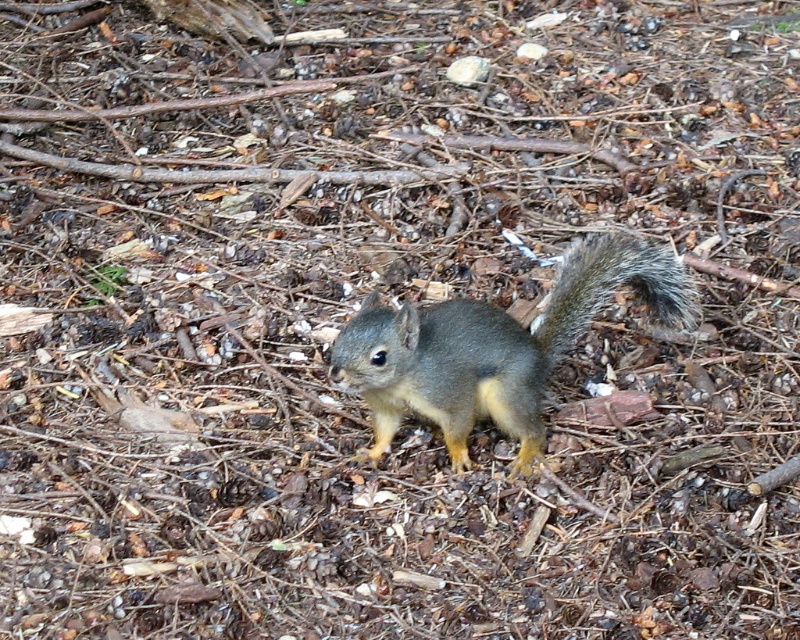
What are the coordinates of `shiny gray squirrel at center` in the screenshot? It's located at (496, 346).

How far apart are shiny gray squirrel at center and fuzzy brown tail at center?

shiny gray squirrel at center is 9.12 centimeters from fuzzy brown tail at center.

The image size is (800, 640). Describe the element at coordinates (496, 346) in the screenshot. I see `shiny gray squirrel at center` at that location.

You are a GUI agent. You are given a task and a screenshot of the screen. Output one action in this format:
    pyautogui.click(x=<x>, y=<y>)
    Task: Click on the shiny gray squirrel at center
    The height and width of the screenshot is (640, 800).
    Given the screenshot: What is the action you would take?
    pyautogui.click(x=496, y=346)